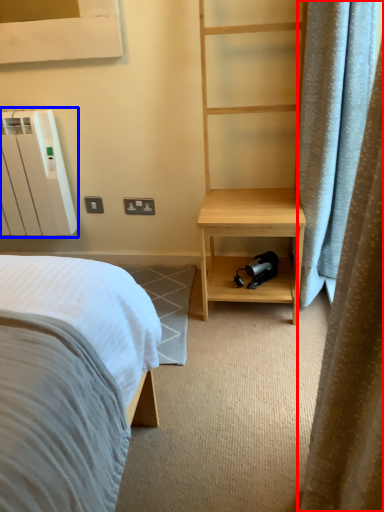
Question: Which object appears farthest to the camera in this image, curtain (highlighted by a red box) or radiator (highlighted by a blue box)?

Choices:
 (A) curtain
 (B) radiator

Answer: (B)